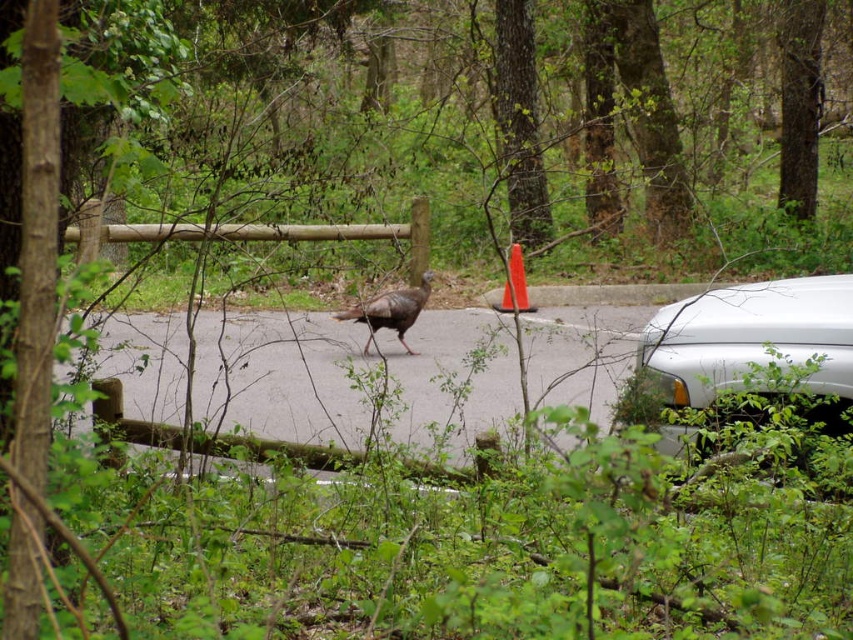
Who is taller, white glossy car at right or orange plastic traffic cone at center?

orange plastic traffic cone at center

Is white glossy car at right to the left of orange plastic traffic cone at center from the viewer's perspective?

No, white glossy car at right is not to the left of orange plastic traffic cone at center.

Measure the distance between white glossy car at right and camera.

white glossy car at right is 5.65 meters from camera.

Identify the location of white glossy car at right. (753, 340).

Does white glossy car at right have a larger size compared to brown feathered turkey at center?

Yes.

Locate an element on the screen. Image resolution: width=853 pixels, height=640 pixels. white glossy car at right is located at coordinates (753, 340).

Is point (720, 291) positioned before point (332, 316)?

Yes, point (720, 291) is in front of point (332, 316).

Identify the location of white glossy car at right. (753, 340).

Is brown feathered turkey at center positioned at the back of orange plastic traffic cone at center?

Yes, it is behind orange plastic traffic cone at center.

Is brown feathered turkey at center to the right of orange plastic traffic cone at center from the viewer's perspective?

No, brown feathered turkey at center is not to the right of orange plastic traffic cone at center.

This screenshot has height=640, width=853. What are the coordinates of `brown feathered turkey at center` in the screenshot? It's located at (390, 310).